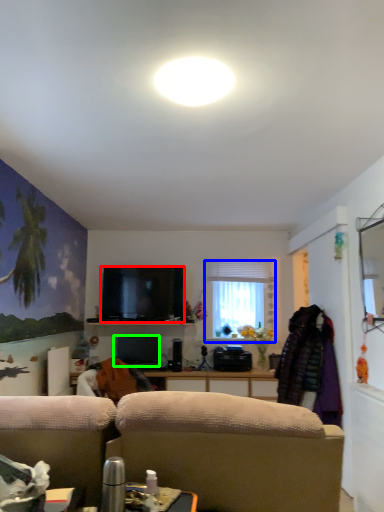
Question: Which object is the closest to the television (highlighted by a red box)? Choose among these: window (highlighted by a blue box) or television (highlighted by a green box).

Choices:
 (A) window
 (B) television

Answer: (B)